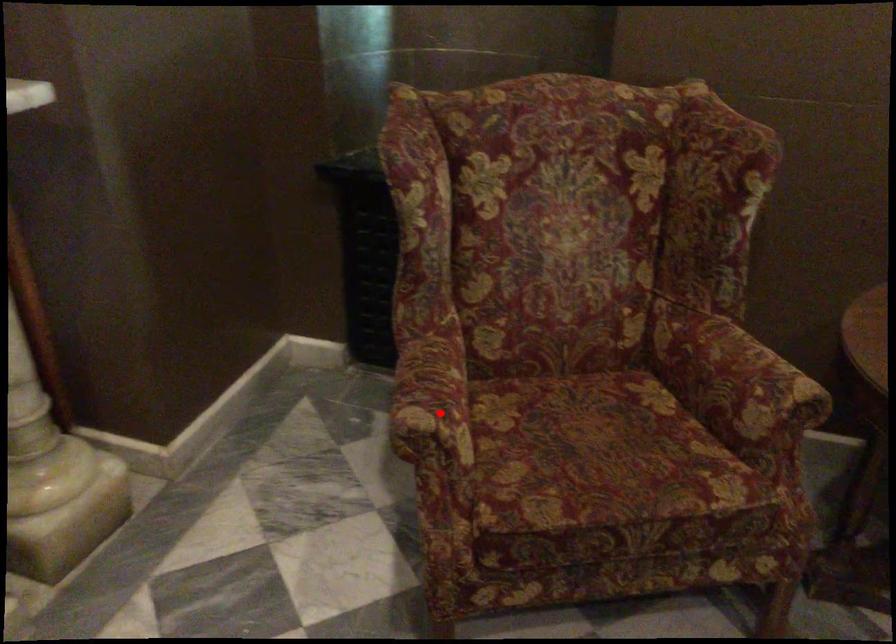
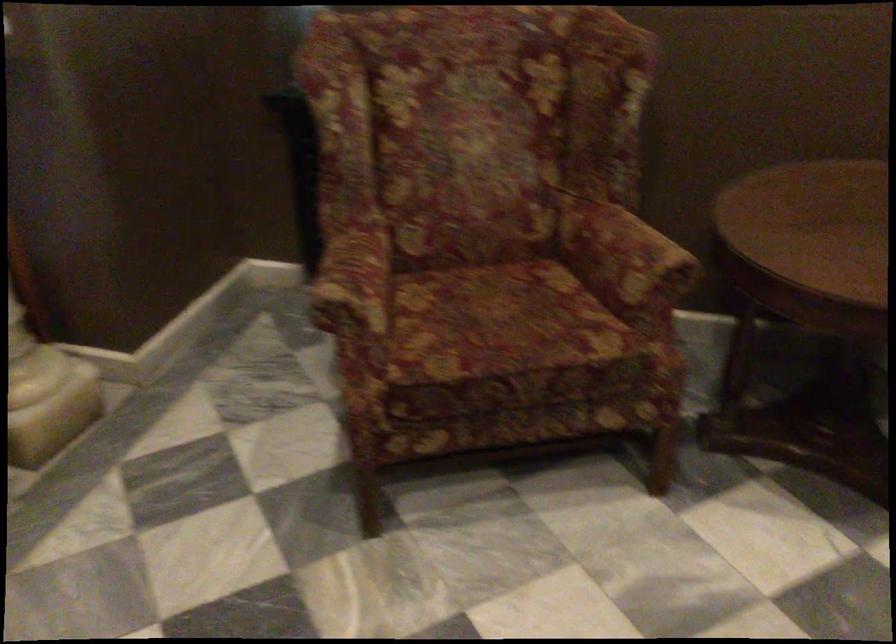
Question: I am providing you with two images of the same scene from different viewpoints. In image1, a red point is highlighted. Considering the same 3D point in image2, which of the following is correct?

Choices:
 (A) It is closer
 (B) It is farther

Answer: (B)